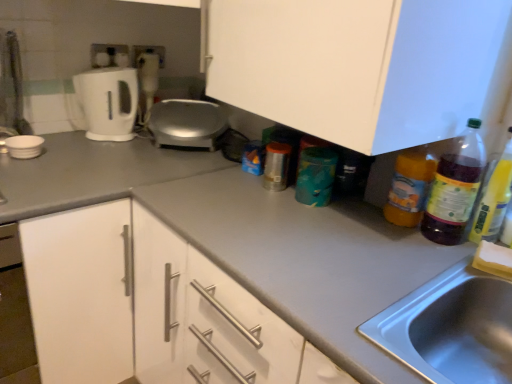
Question: Is gray matte countertop at center completely or partially outside of satin silver appliance at center, the 1th appliance in the back-to-front sequence?

Choices:
 (A) yes
 (B) no

Answer: (A)

Question: Is satin silver appliance at center, placed as the second appliance when sorted from front to back, inside gray matte countertop at center?

Choices:
 (A) no
 (B) yes

Answer: (A)

Question: Considering the relative positions of gray matte countertop at center and satin silver appliance at center, the 1th appliance in the back-to-front sequence, in the image provided, is gray matte countertop at center to the left of satin silver appliance at center, the 1th appliance in the back-to-front sequence, from the viewer's perspective?

Choices:
 (A) no
 (B) yes

Answer: (A)

Question: Can you confirm if gray matte countertop at center is positioned to the right of satin silver appliance at center, placed as the second appliance when sorted from front to back?

Choices:
 (A) no
 (B) yes

Answer: (B)

Question: Is gray matte countertop at center positioned behind satin silver appliance at center, the 1th appliance in the back-to-front sequence?

Choices:
 (A) no
 (B) yes

Answer: (A)

Question: From the image's perspective, is gray matte countertop at center below satin silver appliance at center, placed as the second appliance when sorted from left to right?

Choices:
 (A) no
 (B) yes

Answer: (B)

Question: Is satin silver appliance at center, the 1th appliance in the back-to-front sequence, facing away from gray matte countertop at center?

Choices:
 (A) no
 (B) yes

Answer: (A)

Question: Is satin silver appliance at center, the 1th appliance viewed from the right, completely or partially outside of gray matte countertop at center?

Choices:
 (A) no
 (B) yes

Answer: (B)

Question: From the image's perspective, is satin silver appliance at center, placed as the second appliance when sorted from left to right, beneath gray matte countertop at center?

Choices:
 (A) no
 (B) yes

Answer: (A)

Question: From a real-world perspective, is satin silver appliance at center, the 1th appliance in the back-to-front sequence, positioned over gray matte countertop at center based on gravity?

Choices:
 (A) yes
 (B) no

Answer: (A)

Question: Is satin silver appliance at center, placed as the second appliance when sorted from left to right, bigger than gray matte countertop at center?

Choices:
 (A) no
 (B) yes

Answer: (A)

Question: Is satin silver appliance at center, the 1th appliance in the back-to-front sequence, positioned behind gray matte countertop at center?

Choices:
 (A) yes
 (B) no

Answer: (A)

Question: From the image's perspective, is translucent plastic bottle at right, which appears as the 2th bottle when viewed from the right, below white matte cabinet at center?

Choices:
 (A) no
 (B) yes

Answer: (B)